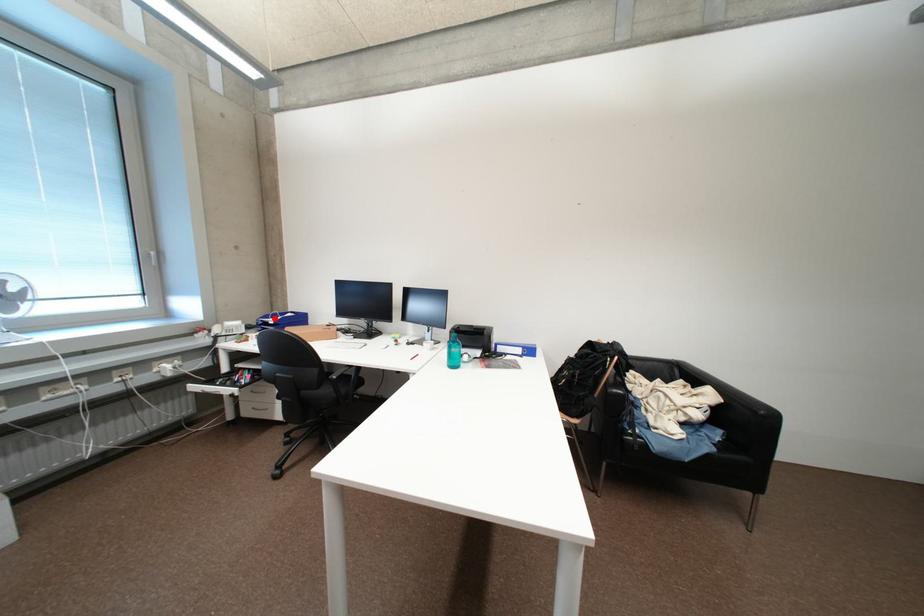
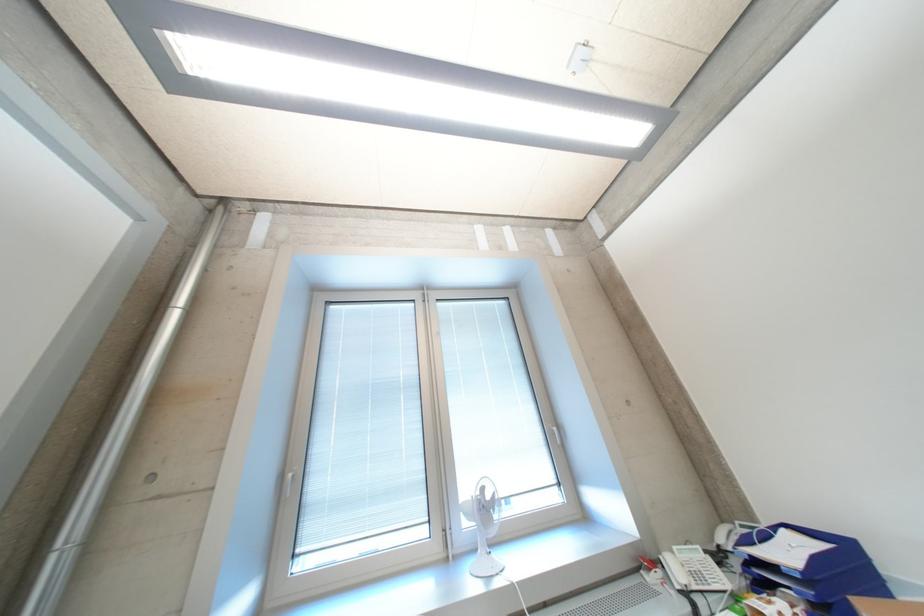
Question: I am providing you with two images of the same scene from different viewpoints. Image1 has a red point marked. In image2, the corresponding 3D location appears at what relative position? Reply with the corresponding letter.

Choices:
 (A) Closer
 (B) Farther

Answer: (A)